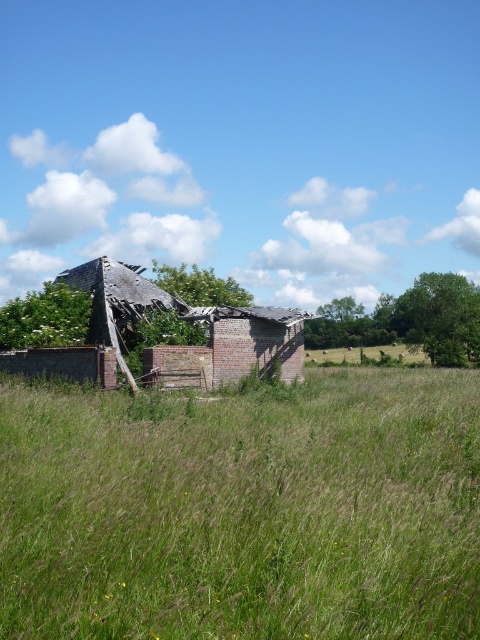
You are standing in the field and see the green grass at center and the brick at center. Which object is closer to the ground?

The green grass at center is closer to the ground since it is located below the brick at center.

You are standing in the middle of the field and see the green grass at center and the brick at center. Which object is located to the right of the other?

The green grass at center is positioned on the right side of brick at center.

You are standing in the field of tall grass in front of the old barn. You notice two points in the scene. Which point, point (25, 547) or point (121, 280), is closer to you?

Point (25, 547) is closer to the viewer than point (121, 280).